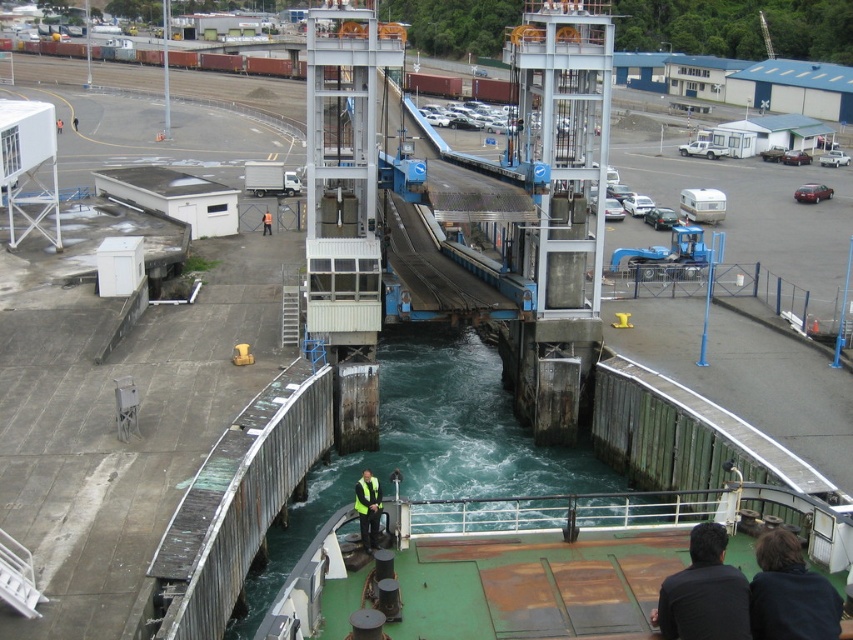
From the picture: You are a crane operator in the port. You need to lower a heavy crate onto the deck. There is a black fabric at lower right and an orange reflective vest at center in your line of sight. Which object is closer to the crane hook so you can avoid hitting it?

The orange reflective vest at center is closer to the crane hook because the black fabric at lower right is taller than the orange reflective vest at center, meaning the vest is lower in height and thus closer to the hook.

You are a safety inspector on a ship docked at the port. You notice two items on the deck that need to be checked for compliance. The black fabric at lower right and the orange reflective vest at center. Which item is bigger in size?

The black fabric at lower right is larger in size than the orange reflective vest at center, so the black fabric at lower right is bigger.